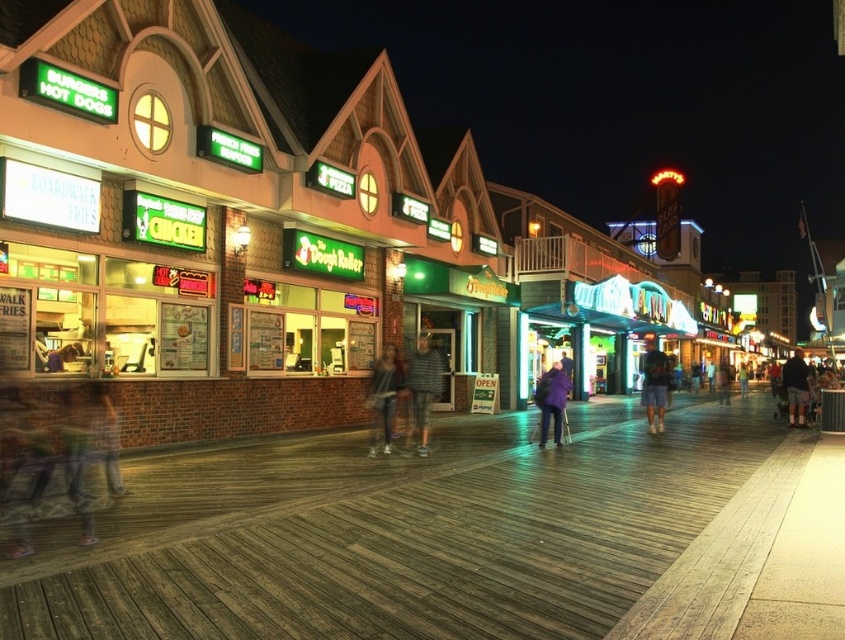
Is purple fabric coat at center taller than dark gray shorts at right?

No.

Between purple fabric coat at center and dark gray shorts at right, which one has more height?

Standing taller between the two is dark gray shorts at right.

At what (x,y) coordinates should I click in order to perform the action: click on purple fabric coat at center. Please return your answer as a coordinate pair (x, y). Looking at the image, I should click on (552, 401).

Is denim jacket at center above dark blue shorts at center?

Indeed, denim jacket at center is positioned over dark blue shorts at center.

Is point (372, 452) positioned in front of point (651, 337)?

Yes.

The height and width of the screenshot is (640, 845). What do you see at coordinates (384, 397) in the screenshot? I see `denim jacket at center` at bounding box center [384, 397].

This screenshot has height=640, width=845. Find the location of `denim jacket at center`. denim jacket at center is located at coordinates (384, 397).

Describe the element at coordinates (422, 388) in the screenshot. I see `striped sweater at center` at that location.

Who is taller, striped sweater at center or dark blue shorts at center?

Standing taller between the two is striped sweater at center.

Who is more forward, (422, 381) or (658, 355)?

Positioned in front is point (422, 381).

You are a GUI agent. You are given a task and a screenshot of the screen. Output one action in this format:
    pyautogui.click(x=<x>, y=<y>)
    Task: Click on the striped sweater at center
    This screenshot has height=640, width=845.
    Given the screenshot: What is the action you would take?
    pyautogui.click(x=422, y=388)